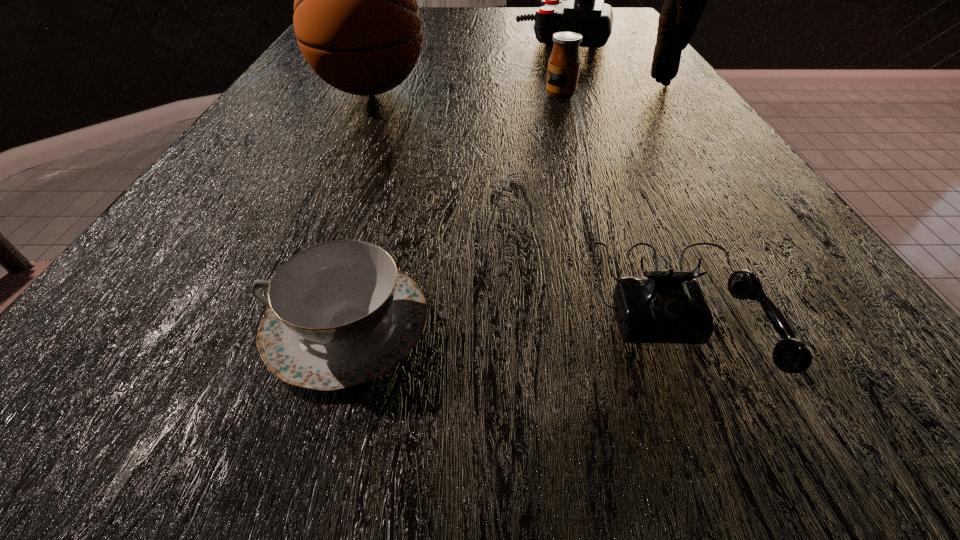
You are a GUI agent. You are given a task and a screenshot of the screen. Output one action in this format:
    pyautogui.click(x=<x>, y=<y>)
    Task: Click on the vacant position located on the front-facing side of the third shortest object
    This screenshot has height=540, width=960.
    Given the screenshot: What is the action you would take?
    pyautogui.click(x=506, y=96)

Where is `free region located 0.190m on the front-facing side of the third shortest object`? The image size is (960, 540). free region located 0.190m on the front-facing side of the third shortest object is located at coordinates (452, 96).

This screenshot has height=540, width=960. In order to click on vacant region located 0.370m on the front-facing side of the third shortest object in this screenshot , I will do `click(366, 96)`.

I want to click on vacant space positioned on the dial of the telephone, so click(741, 442).

Locate an element on the screen. This screenshot has height=540, width=960. vacant region located 0.050m on the handle side of the chinaware is located at coordinates (222, 325).

Find the location of a particular element. The height and width of the screenshot is (540, 960). free region located on the handle side of the chinaware is located at coordinates (112, 325).

The image size is (960, 540). I want to click on free space located on the handle side of the chinaware, so click(131, 325).

Locate an element on the screen. The width and height of the screenshot is (960, 540). object present at the far edge is located at coordinates (584, 12).

You are a GUI agent. You are given a task and a screenshot of the screen. Output one action in this format:
    pyautogui.click(x=<x>, y=<y>)
    Task: Click on the object that is at the left edge
    
    Given the screenshot: What is the action you would take?
    pyautogui.click(x=357, y=22)

The width and height of the screenshot is (960, 540). What are the coordinates of `figurine positioned at the right edge` in the screenshot? It's located at (685, 2).